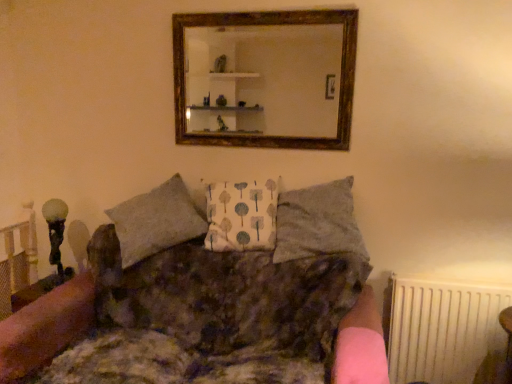
Identify the location of wooden frame mirror at upper center. This screenshot has width=512, height=384. (264, 79).

The image size is (512, 384). Identify the location of white plastic radiator at lower right. (444, 331).

What do you see at coordinates (444, 331) in the screenshot? I see `white plastic radiator at lower right` at bounding box center [444, 331].

In order to face textured brown fabric couch at center, should I rotate leftwards or rightwards?

You should look left and rotate roughly 7.350 degrees.

The width and height of the screenshot is (512, 384). In order to click on wooden frame mirror at upper center in this screenshot , I will do `click(264, 79)`.

Is white plastic radiator at lower right in contact with textured gray pillow at center, which is the 1th pillow from right to left?

No.

From a real-world perspective, between white plastic radiator at lower right and textured gray pillow at center, which is counted as the second pillow, starting from the left, who is vertically higher?

textured gray pillow at center, which is counted as the second pillow, starting from the left, is physically above.

From the picture: Can you confirm if white plastic radiator at lower right is taller than textured gray pillow at center, which is the 1th pillow from right to left?

Yes, white plastic radiator at lower right is taller than textured gray pillow at center, which is the 1th pillow from right to left.

Could textured gray pillow at center, which is counted as the second pillow, starting from the left, be considered to be inside white plastic radiator at lower right?

Definitely not — textured gray pillow at center, which is counted as the second pillow, starting from the left, is not inside white plastic radiator at lower right.

In order to click on mirror behind the textured brown fabric couch at center in this screenshot , I will do [264, 79].

Is the depth of textured brown fabric couch at center greater than that of wooden frame mirror at upper center?

That is False.

Would you say textured brown fabric couch at center is to the left or to the right of wooden frame mirror at upper center in the picture?

Based on their positions, textured brown fabric couch at center is located to the left of wooden frame mirror at upper center.

Is textured brown fabric couch at center situated inside wooden frame mirror at upper center or outside?

textured brown fabric couch at center is not inside wooden frame mirror at upper center, it's outside.

How many degrees apart are the facing directions of white plastic radiator at lower right and white fabric pillow at center, placed as the second pillow when sorted from right to left?

13.4 degrees.

How distant is white plastic radiator at lower right from white fabric pillow at center, placed as the first pillow when sorted from left to right?

They are 84.67 centimeters apart.

Is point (433, 289) positioned after point (231, 195)?

No, (433, 289) is in front of (231, 195).

Find the location of a particular element. This screenshot has width=512, height=384. radiator lying below the white fabric pillow at center, placed as the second pillow when sorted from right to left (from the image's perspective) is located at coordinates pos(444,331).

In the scene shown: Considering the relative sizes of white fabric pillow at center, placed as the first pillow when sorted from left to right, and textured brown fabric couch at center in the image provided, is white fabric pillow at center, placed as the first pillow when sorted from left to right, thinner than textured brown fabric couch at center?

Yes, white fabric pillow at center, placed as the first pillow when sorted from left to right, is thinner than textured brown fabric couch at center.

Does white fabric pillow at center, placed as the first pillow when sorted from left to right, have a smaller size compared to textured brown fabric couch at center?

Correct, white fabric pillow at center, placed as the first pillow when sorted from left to right, occupies less space than textured brown fabric couch at center.

Which is correct: white fabric pillow at center, placed as the second pillow when sorted from right to left, is inside textured brown fabric couch at center, or outside of it?

white fabric pillow at center, placed as the second pillow when sorted from right to left, lies outside textured brown fabric couch at center.

Does textured gray pillow at center, which is counted as the second pillow, starting from the left, have a lesser height compared to white fabric pillow at center, placed as the first pillow when sorted from left to right?

Yes.

Which is correct: textured gray pillow at center, which is counted as the second pillow, starting from the left, is inside white fabric pillow at center, placed as the second pillow when sorted from right to left, or outside of it?

The correct answer is: outside.

Can you tell me how much textured gray pillow at center, which is the 1th pillow from right to left, and white fabric pillow at center, placed as the second pillow when sorted from right to left, differ in facing direction?

They differ by 12.5 degrees in their facing directions.

From the image's perspective, who appears lower, textured gray pillow at center, which is counted as the second pillow, starting from the left, or white fabric pillow at center, placed as the first pillow when sorted from left to right?

textured gray pillow at center, which is counted as the second pillow, starting from the left, from the image's perspective.

In the image, is wooden frame mirror at upper center on the left side or the right side of textured brown fabric couch at center?

wooden frame mirror at upper center is positioned on textured brown fabric couch at center's right side.

From the image's perspective, is wooden frame mirror at upper center above or below textured brown fabric couch at center?

wooden frame mirror at upper center is situated higher than textured brown fabric couch at center in the image.

Who is smaller, wooden frame mirror at upper center or textured brown fabric couch at center?

wooden frame mirror at upper center.

Is textured gray pillow at center, which is counted as the second pillow, starting from the left, located within textured brown fabric couch at center?

No, textured gray pillow at center, which is counted as the second pillow, starting from the left, is not surrounded by textured brown fabric couch at center.

Considering the sizes of objects textured brown fabric couch at center and textured gray pillow at center, which is counted as the second pillow, starting from the left, in the image provided, who is taller, textured brown fabric couch at center or textured gray pillow at center, which is counted as the second pillow, starting from the left,?

textured brown fabric couch at center.

Is textured brown fabric couch at center in front of or behind textured gray pillow at center, which is the 1th pillow from right to left, in the image?

In the image, textured brown fabric couch at center appears in front of textured gray pillow at center, which is the 1th pillow from right to left.

At what (x,y) coordinates should I click in order to perform the action: click on studio couch in front of the textured gray pillow at center, which is the 1th pillow from right to left. Please return your answer as a coordinate pair (x, y). Looking at the image, I should click on (205, 315).

Locate an element on the screen. This screenshot has width=512, height=384. radiator below the textured gray pillow at center, which is counted as the second pillow, starting from the left (from a real-world perspective) is located at coordinates click(x=444, y=331).

Where is `studio couch that appears below the wooden frame mirror at upper center (from the image's perspective)`? This screenshot has width=512, height=384. studio couch that appears below the wooden frame mirror at upper center (from the image's perspective) is located at coordinates (205, 315).

Considering their positions, is wooden frame mirror at upper center positioned closer to textured brown fabric couch at center than textured gray pillow at center, which is the 1th pillow from right to left?

Based on the image, textured gray pillow at center, which is the 1th pillow from right to left, appears to be nearer to textured brown fabric couch at center.

Based on their spatial positions, is white plastic radiator at lower right or wooden frame mirror at upper center closer to white fabric pillow at center, placed as the first pillow when sorted from left to right?

wooden frame mirror at upper center is closer to white fabric pillow at center, placed as the first pillow when sorted from left to right.

Estimate the real-world distances between objects in this image. Which object is closer to white plastic radiator at lower right, wooden frame mirror at upper center or white fabric pillow at center, placed as the second pillow when sorted from right to left?

white fabric pillow at center, placed as the second pillow when sorted from right to left.

From the image, which object appears to be nearer to textured brown fabric couch at center, white fabric pillow at center, placed as the second pillow when sorted from right to left, or wooden frame mirror at upper center?

Based on the image, white fabric pillow at center, placed as the second pillow when sorted from right to left, appears to be nearer to textured brown fabric couch at center.

When comparing their distances from textured brown fabric couch at center, does white fabric pillow at center, placed as the second pillow when sorted from right to left, or textured gray pillow at center, which is counted as the second pillow, starting from the left, seem closer?

textured gray pillow at center, which is counted as the second pillow, starting from the left, is closer to textured brown fabric couch at center.

From the image, which object appears to be nearer to white plastic radiator at lower right, white fabric pillow at center, placed as the first pillow when sorted from left to right, or wooden frame mirror at upper center?

white fabric pillow at center, placed as the first pillow when sorted from left to right, is positioned closer to the anchor white plastic radiator at lower right.

Looking at the image, which one is located closer to wooden frame mirror at upper center, white fabric pillow at center, placed as the first pillow when sorted from left to right, or white plastic radiator at lower right?

white fabric pillow at center, placed as the first pillow when sorted from left to right, is closer to wooden frame mirror at upper center.

Which object lies nearer to the anchor point wooden frame mirror at upper center, white fabric pillow at center, placed as the first pillow when sorted from left to right, or textured gray pillow at center, which is counted as the second pillow, starting from the left?

white fabric pillow at center, placed as the first pillow when sorted from left to right.

What are the coordinates of `pillow located between textured brown fabric couch at center and white fabric pillow at center, placed as the first pillow when sorted from left to right, in the depth direction` in the screenshot? It's located at (317, 222).

Image resolution: width=512 pixels, height=384 pixels. Identify the location of pillow between wooden frame mirror at upper center and textured gray pillow at center, which is the 1th pillow from right to left, in the up-down direction. (241, 216).

At what (x,y) coordinates should I click in order to perform the action: click on studio couch between wooden frame mirror at upper center and white plastic radiator at lower right from top to bottom. Please return your answer as a coordinate pair (x, y). Looking at the image, I should click on (205, 315).

This screenshot has width=512, height=384. I want to click on pillow between white fabric pillow at center, placed as the second pillow when sorted from right to left, and white plastic radiator at lower right from left to right, so click(317, 222).